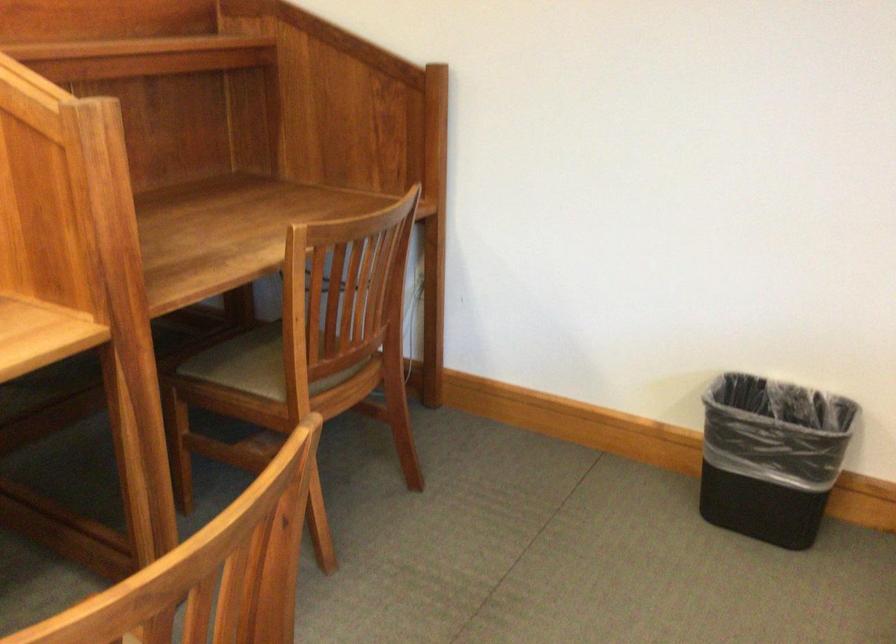
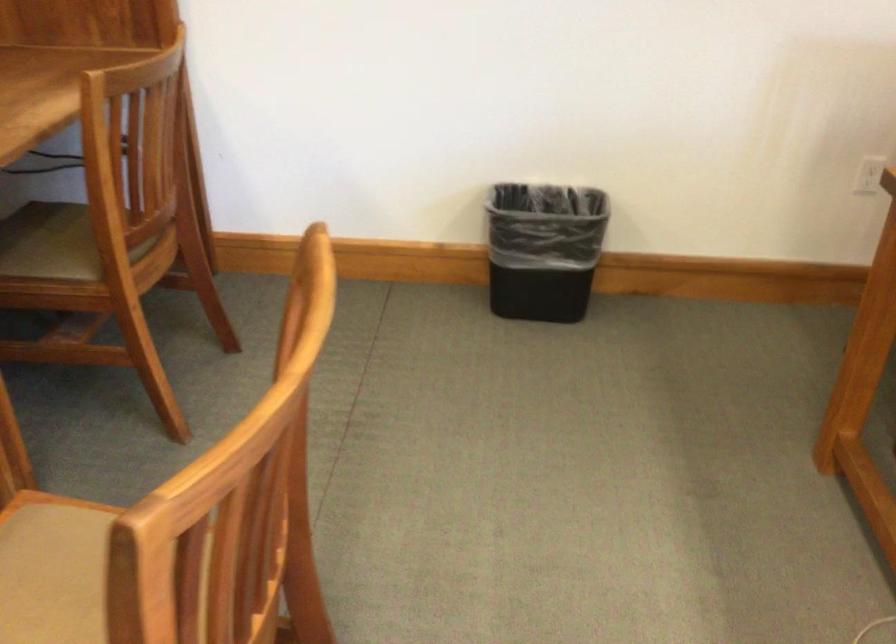
Question: In a continuous first-person perspective shot, in which direction is the camera moving?

Choices:
 (A) Left
 (B) Right
 (C) Forward
 (D) Backward

Answer: (A)